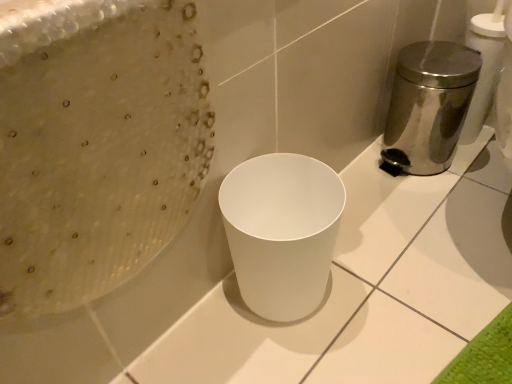
Question: Based on their sizes in the image, would you say white matte waste container at center is bigger or smaller than polished stainless steel trash can at right?

Choices:
 (A) big
 (B) small

Answer: (B)

Question: Is white matte waste container at center in front of or behind polished stainless steel trash can at right in the image?

Choices:
 (A) behind
 (B) front

Answer: (B)

Question: From their relative heights in the image, would you say white matte waste container at center is taller or shorter than polished stainless steel trash can at right?

Choices:
 (A) short
 (B) tall

Answer: (A)

Question: Based on their sizes in the image, would you say polished stainless steel trash can at right is bigger or smaller than white matte waste container at center?

Choices:
 (A) small
 (B) big

Answer: (B)

Question: Is point (410, 56) positioned closer to the camera than point (245, 175)?

Choices:
 (A) farther
 (B) closer

Answer: (A)

Question: From the image's perspective, is polished stainless steel trash can at right located above or below white matte waste container at center?

Choices:
 (A) below
 (B) above

Answer: (B)

Question: Considering their positions, is polished stainless steel trash can at right located in front of or behind white matte waste container at center?

Choices:
 (A) behind
 (B) front

Answer: (A)